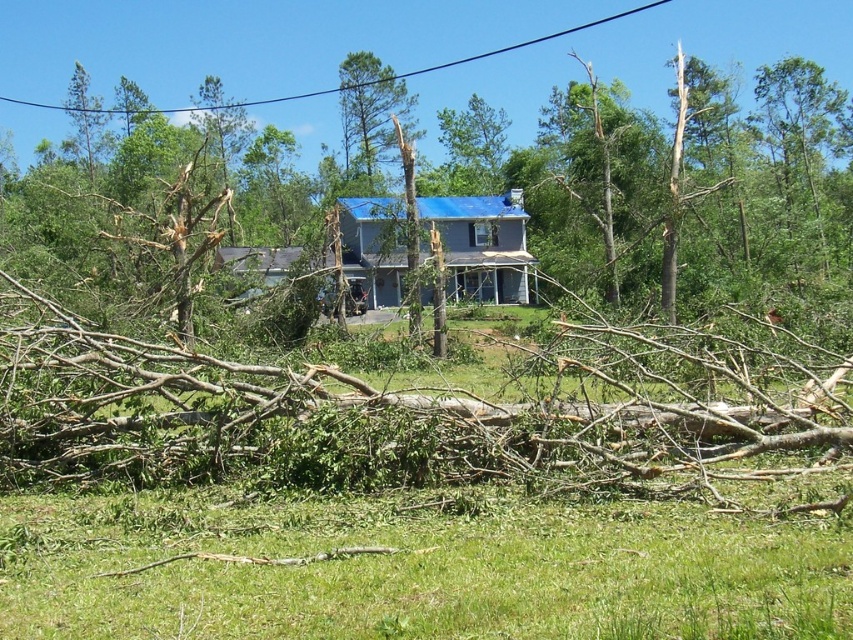
You are a rescue worker assessing the scene. You notice the brown wood tree at center and the black wire at upper center. Which object is taller?

The brown wood tree at center is taller than the black wire at upper center.

You are a utility worker assessing damage after a storm. You see the green rough bark tree at center and the black wire at upper center. Which object is closer to the left side of the image?

The green rough bark tree at center is closer to the left side of the image than the black wire at upper center.

You are standing at the center of the lawn in the residential area. You need to reach the blue roof house in the background. Which direction should you walk to avoid the green rough bark tree at center?

The green rough bark tree at center is located at point (370, 116). To avoid it, you should walk in a direction away from that coordinate, such as north or east, towards the blue roof house in the background.